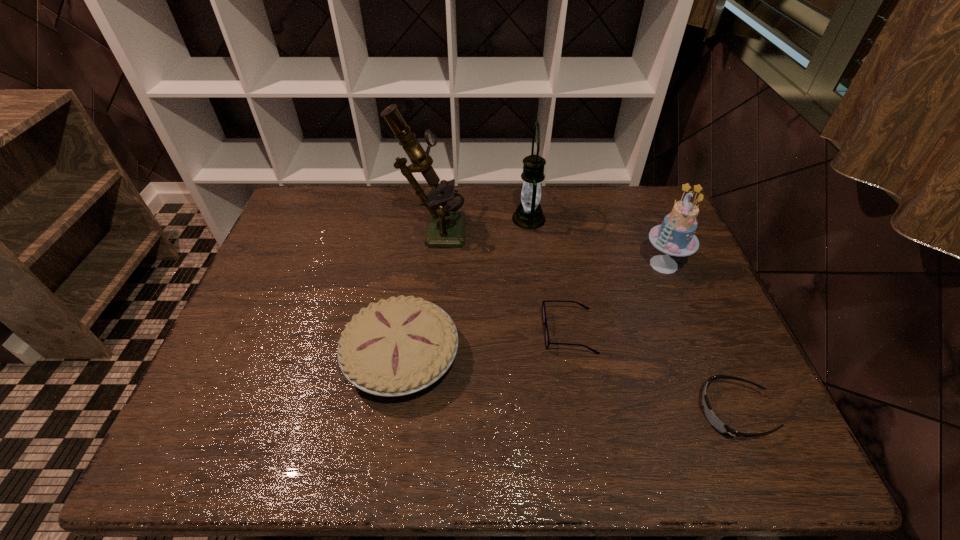
This screenshot has width=960, height=540. Find the location of `microscope located at the far edge`. microscope located at the far edge is located at coordinates (445, 227).

Locate an element on the screen. The image size is (960, 540). lantern that is at the far edge is located at coordinates (528, 215).

Locate an element on the screen. object positioned at the near edge is located at coordinates (722, 428).

Image resolution: width=960 pixels, height=540 pixels. I want to click on cake that is at the right edge, so click(x=675, y=236).

Identify the location of sunglasses present at the right edge. Image resolution: width=960 pixels, height=540 pixels. (722, 428).

Where is `object at the near right corner`? The height and width of the screenshot is (540, 960). object at the near right corner is located at coordinates click(x=722, y=428).

What are the coordinates of `vacant space at the far edge of the desktop` in the screenshot? It's located at click(579, 217).

Identify the location of vacant space at the near edge. (559, 431).

Identify the location of vacant space at the left edge. This screenshot has height=540, width=960. (314, 230).

Find the location of a particular element. vacant space at the right edge is located at coordinates (673, 329).